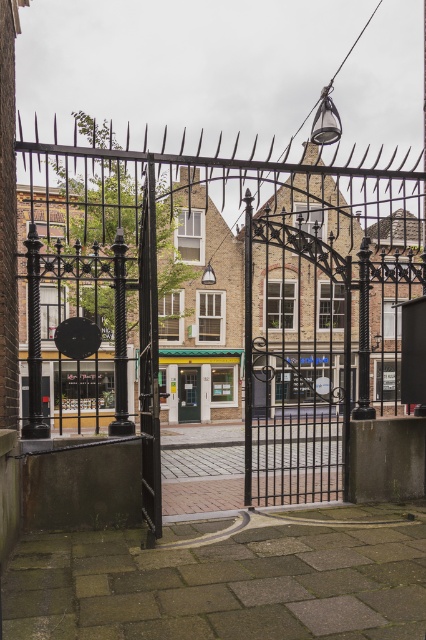
From the picture: You are standing in front of the black wrought iron gate with pointed decorative spikes at the top. There is a point at coordinate (40, 253) on the gate. If you want to reach this point with a 7.5 meter long pole, can you just barely touch it?

The point at coordinate (40, 253) is 7.57 meters from the viewer. Since the pole is 7.5 meters long, it is slightly shorter than the required distance. Therefore, you cannot just barely touch the point with the pole.

You are a delivery person trying to enter the property through the gate. The black wrought iron gate at center and the metallic door at center are both in your path. Which one should you go through to access the property?

The black wrought iron gate at center is larger in size than the metallic door at center, so you should go through the black wrought iron gate at center to access the property since it is the main entrance.

You are standing at the entrance of the urban street and want to walk through the black wrought iron gate at center. Where exactly should you walk to enter?

The black wrought iron gate at center is located at point (259, 298), so you should walk towards that coordinate to enter.